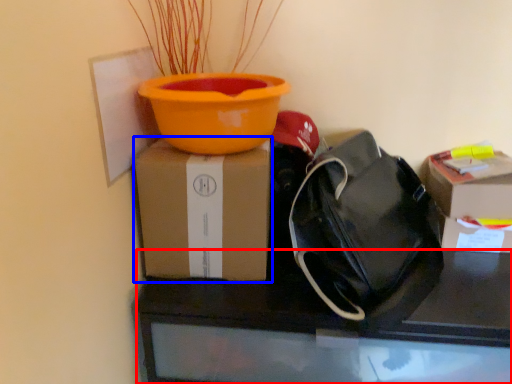
Question: Which of the following is the closest to the observer, desk (highlighted by a red box) or box (highlighted by a blue box)?

Choices:
 (A) desk
 (B) box

Answer: (A)